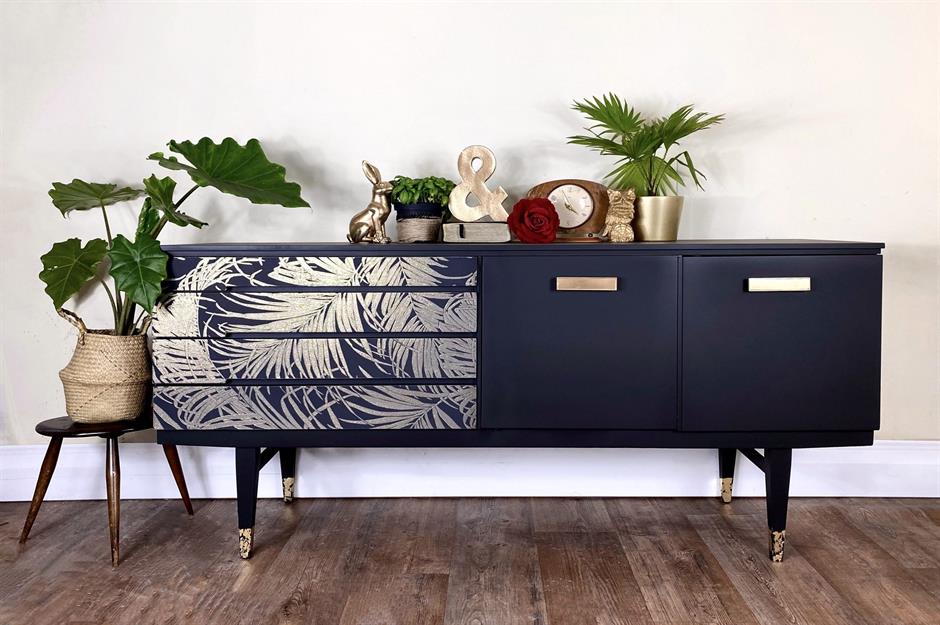
The width and height of the screenshot is (940, 625). Find the location of `gold leaf design`. gold leaf design is located at coordinates (414, 270).